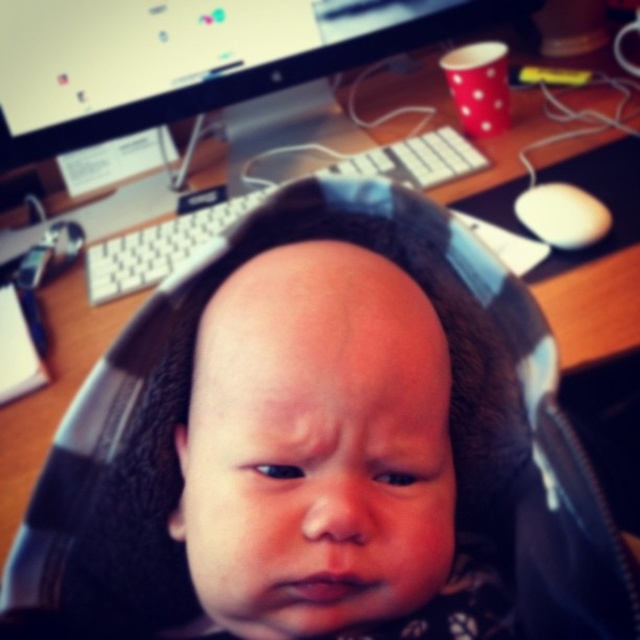
Looking at this image, between smooth skin baby at center and white plastic keyboard at center, which one has more height?

white plastic keyboard at center is taller.

Who is higher up, smooth skin baby at center or white plastic keyboard at center?

white plastic keyboard at center is above.

Who is more forward, (188, 512) or (88, 282)?

Point (188, 512)

The image size is (640, 640). In order to click on smooth skin baby at center in this screenshot , I will do `click(317, 433)`.